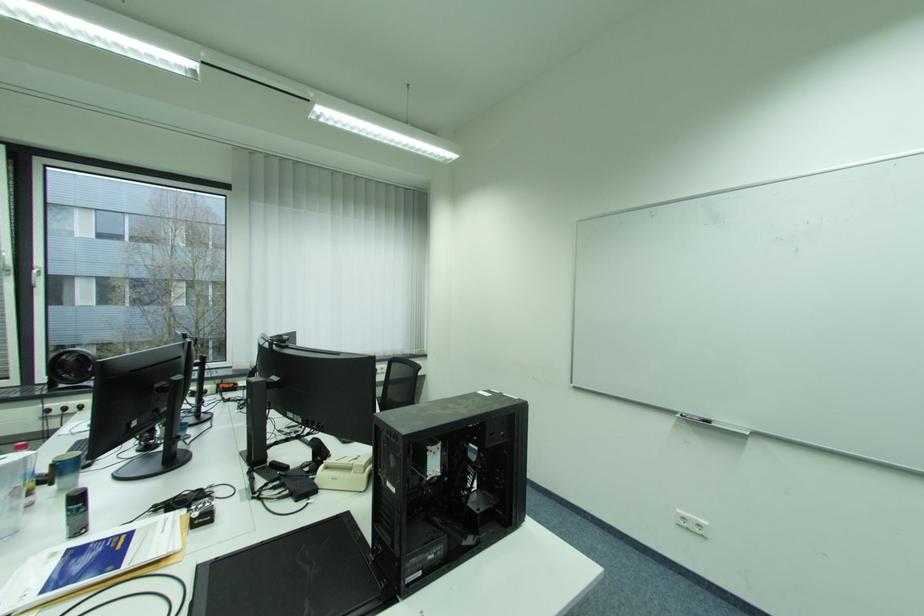
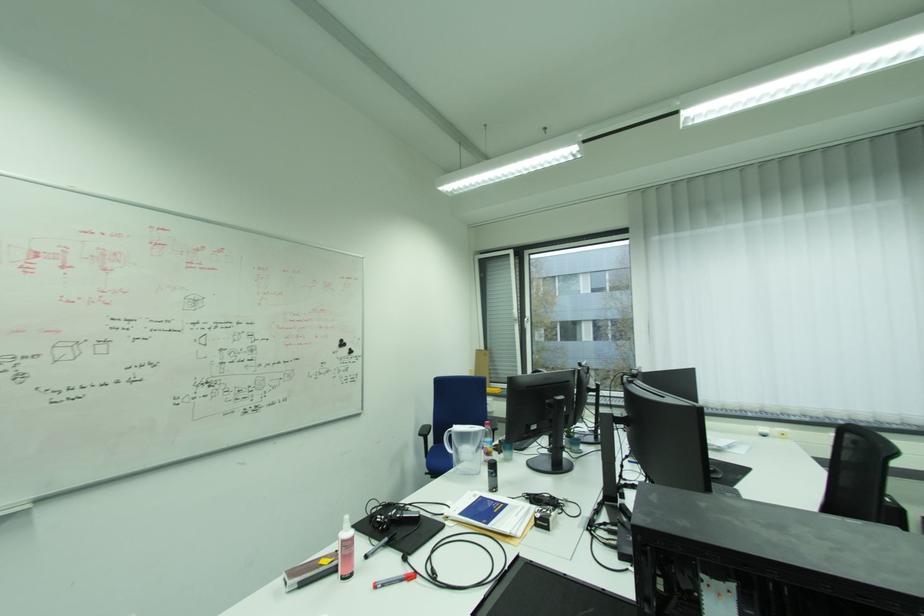
Question: The camera is either moving clockwise (left) or counter-clockwise (right) around the object. The first image is from the beginning of the video and the second image is from the end. Is the camera moving left or right when shooting the video?

Choices:
 (A) Left
 (B) Right

Answer: (B)